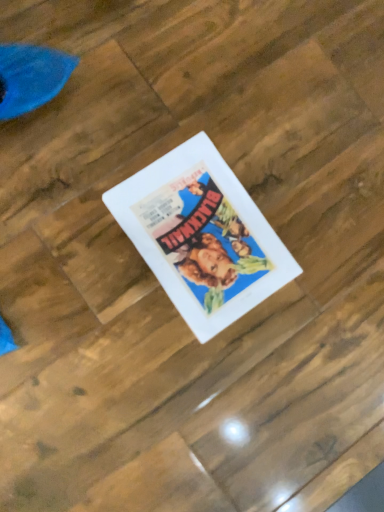
You are a GUI agent. You are given a task and a screenshot of the screen. Output one action in this format:
    pyautogui.click(x=<x>, y=<y>)
    Task: Click on the white paper at center
    The image size is (384, 512).
    Given the screenshot: What is the action you would take?
    pyautogui.click(x=202, y=236)

This screenshot has width=384, height=512. Describe the element at coordinates (202, 236) in the screenshot. I see `white paper at center` at that location.

Locate an element on the screen. This screenshot has height=512, width=384. white paper at center is located at coordinates (202, 236).